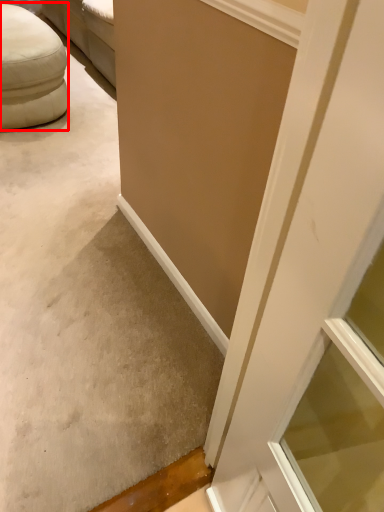
Question: From the image's perspective, where is furniture (annotated by the red box) located relative to concrete?

Choices:
 (A) above
 (B) below

Answer: (A)